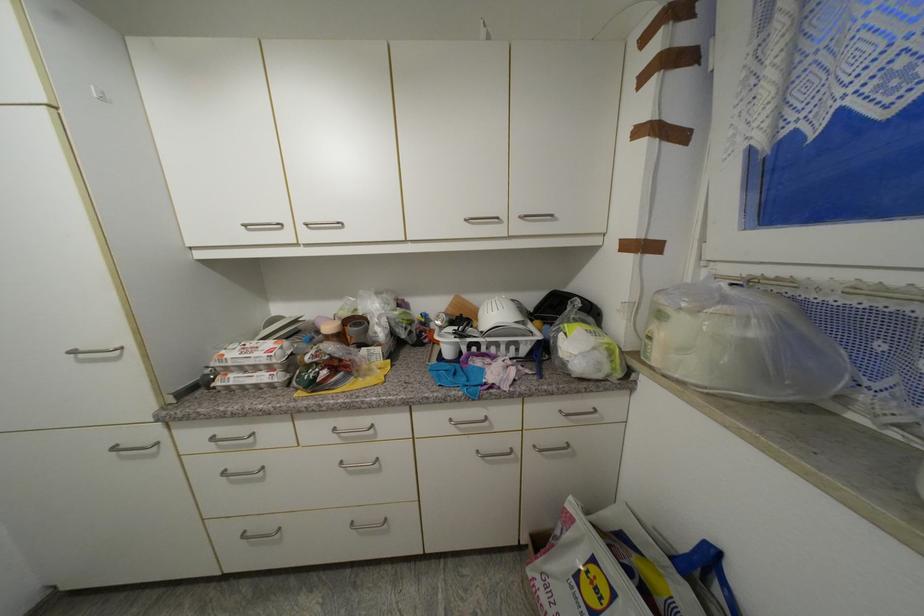
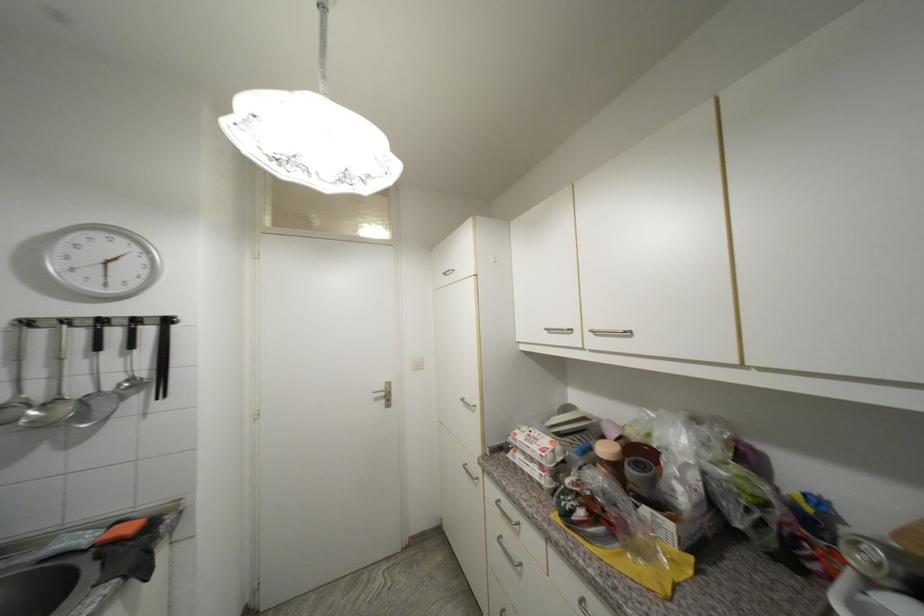
Find the pixel in the second image that matches pixel 79 354 in the first image.

(468, 400)